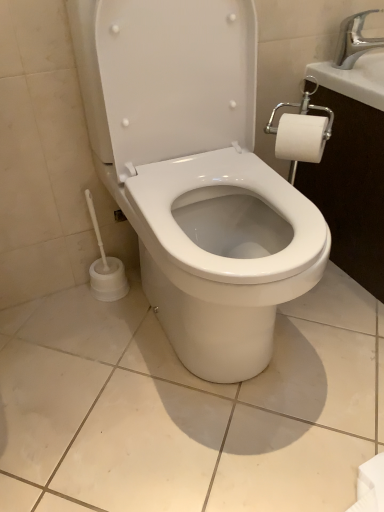
At what (x,y) coordinates should I click in order to perform the action: click on chrome metallic faucet at upper right. Please return your answer as a coordinate pair (x, y). Looking at the image, I should click on (354, 40).

What do you see at coordinates (354, 40) in the screenshot? The image size is (384, 512). I see `chrome metallic faucet at upper right` at bounding box center [354, 40].

Where is `chrome metallic faucet at upper right`? This screenshot has width=384, height=512. chrome metallic faucet at upper right is located at coordinates (354, 40).